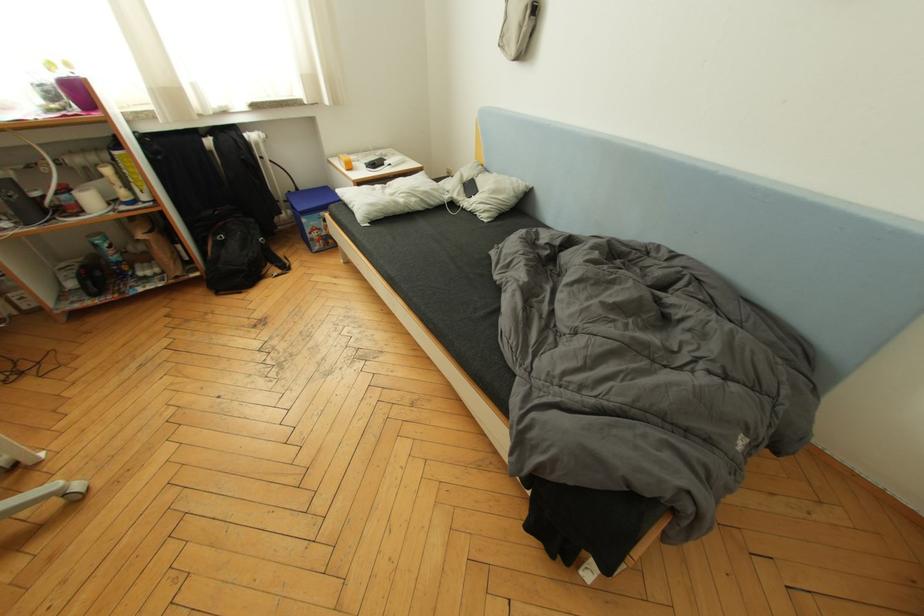
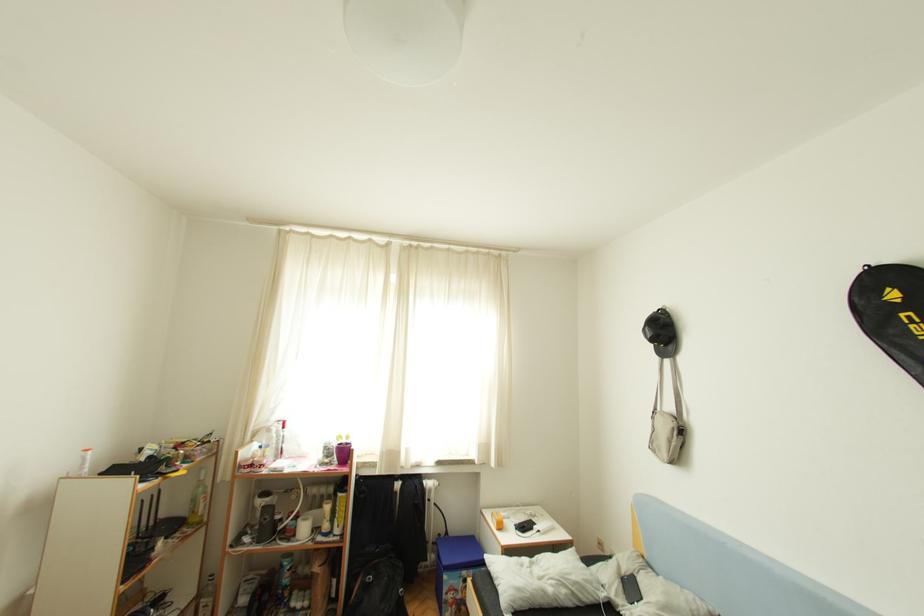
How did the camera likely rotate?

The rotation direction of the camera is left-up.